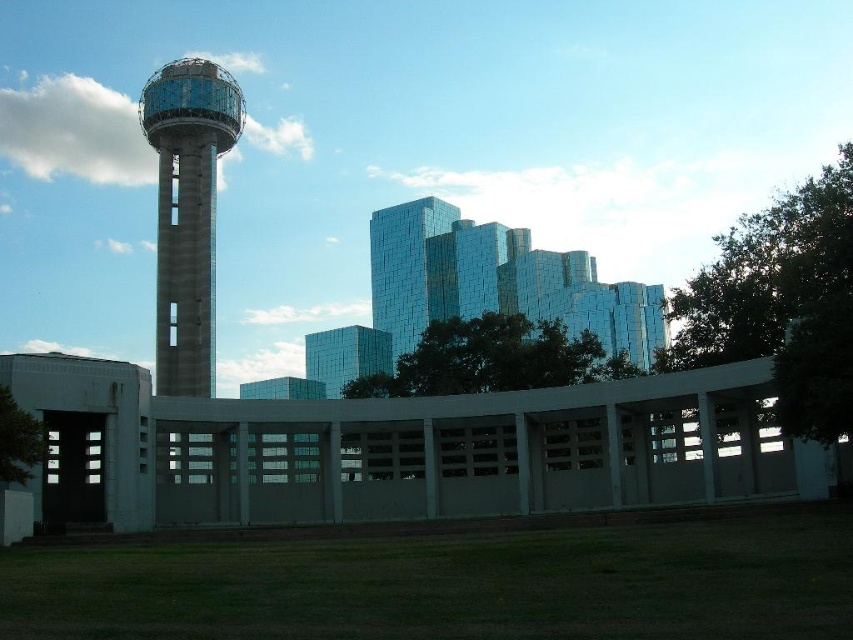
You are standing at the center of the park and see the point marked at coordinates (187, 212). Which structure is this point located on?

The point marked at coordinates (187, 212) is located on the concrete water tower at left.

You are standing at the center of the image. Which direction should you face to see the concrete water tower at left?

You should face to the left to see the concrete water tower at left since it is located at point (187,212), which is on the left side of the image.

You are standing in the park area in front of the Reunion Tower. You see a concrete water tower at left and a glossy glass building at center. Which object is closer to your left side?

The concrete water tower at left is closer to your left side because it is positioned to the left of the glossy glass building at center.